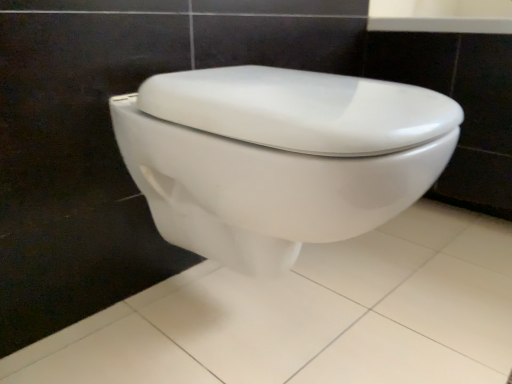
This screenshot has width=512, height=384. What are the coordinates of `vacant space situated above white glossy toilet at center (from a real-world perspective)` in the screenshot? It's located at (360, 287).